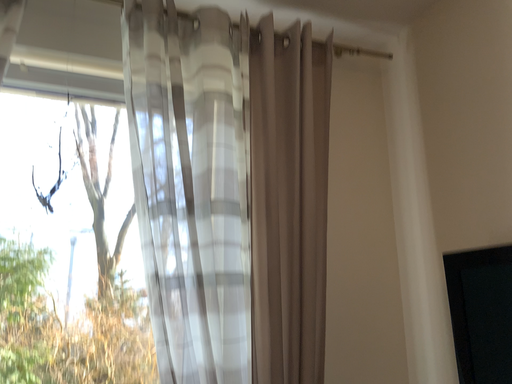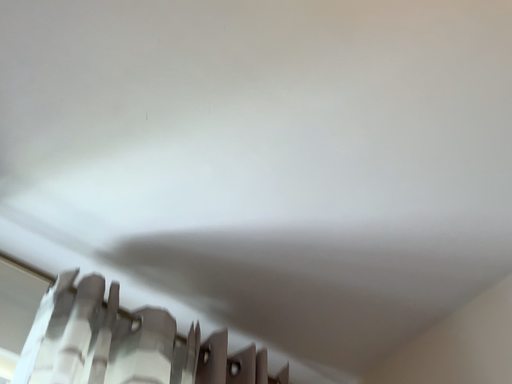
Question: How did the camera likely rotate when shooting the video?

Choices:
 (A) rotated left
 (B) rotated right

Answer: (B)